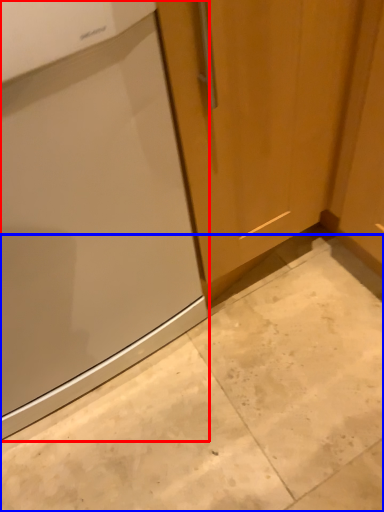
Question: Among these objects, which one is nearest to the camera, home appliance (highlighted by a red box) or concrete (highlighted by a blue box)?

Choices:
 (A) home appliance
 (B) concrete

Answer: (B)